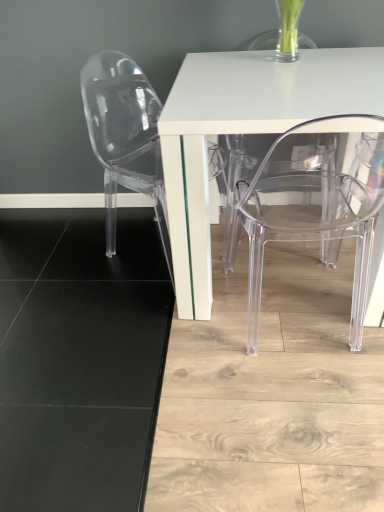
The image size is (384, 512). What are the coordinates of `vacant space in front of transparent acrylic chair at lower right, the first chair when ordered from right to left` in the screenshot? It's located at (302, 401).